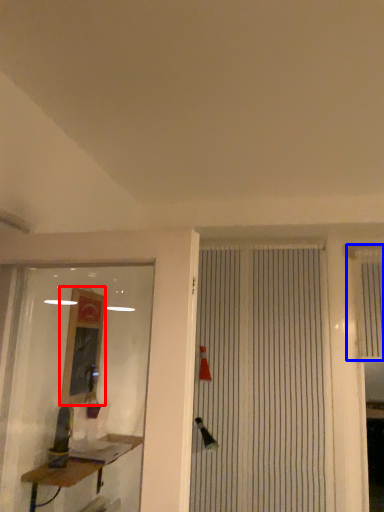
Question: Which object appears closest to the camera in this image, job (highlighted by a red box) or shutter (highlighted by a blue box)?

Choices:
 (A) job
 (B) shutter

Answer: (A)